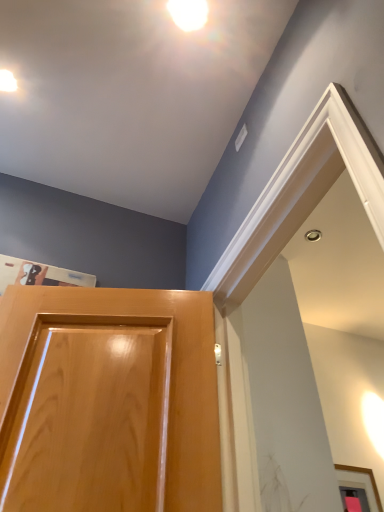
Question: Would you say glossy wood door at lower left is to the left or to the right of white glossy droplight at upper center, the 2th droplight viewed from the left, in the picture?

Choices:
 (A) left
 (B) right

Answer: (A)

Question: Looking at their shapes, would you say glossy wood door at lower left is wider or thinner than white glossy droplight at upper center, the 2th droplight when ordered from bottom to top?

Choices:
 (A) thin
 (B) wide

Answer: (B)

Question: Estimate the real-world distances between objects in this image. Which object is farther from the white glossy droplight at upper center, the first droplight in the front-to-back sequence?

Choices:
 (A) matte white droplight at upper left, which is counted as the second droplight, starting from the right
 (B) glossy wood door at lower left

Answer: (B)

Question: Estimate the real-world distances between objects in this image. Which object is farther from the white glossy droplight at upper center, the first droplight in the front-to-back sequence?

Choices:
 (A) matte white droplight at upper left, which is counted as the 1th droplight, starting from the left
 (B) glossy wood door at lower left

Answer: (B)